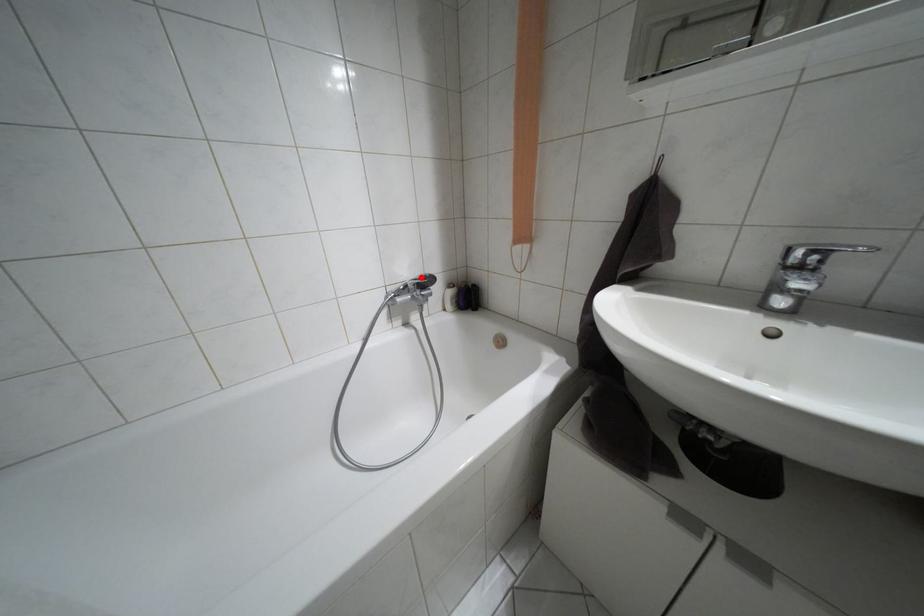
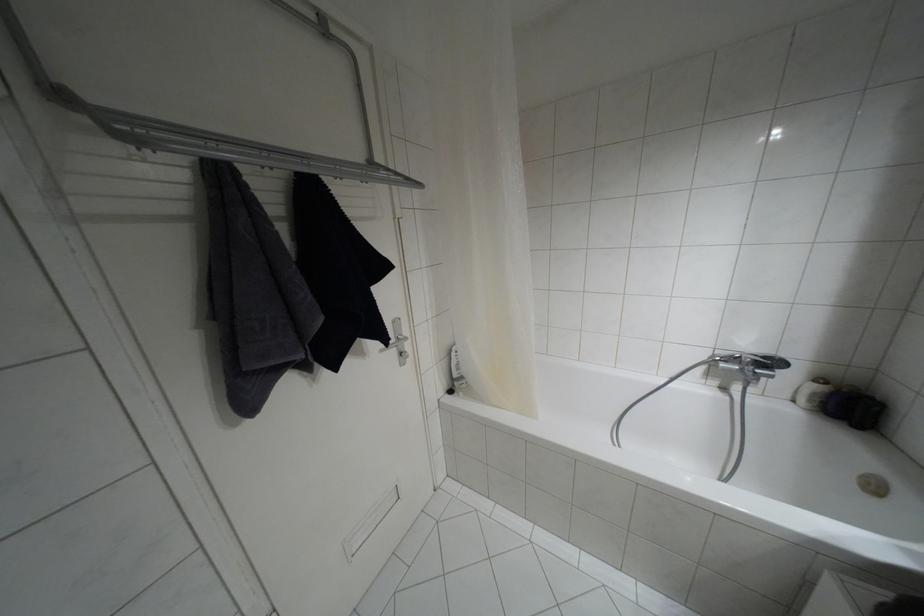
In the second image, find the point that corresponds to the highlighted location in the first image.

(763, 357)